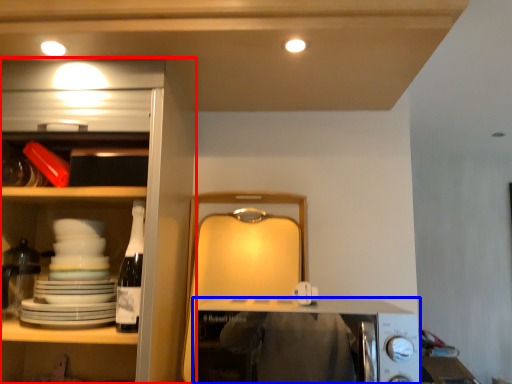
Question: Which object is closer to the camera taking this photo, cabinetry (highlighted by a red box) or appliance (highlighted by a blue box)?

Choices:
 (A) cabinetry
 (B) appliance

Answer: (B)